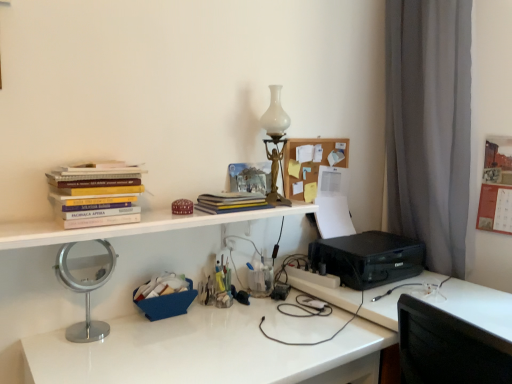
Where is `vacant region to the right of translucent plastic container at center, the second stationery when ordered from bottom to top`? The width and height of the screenshot is (512, 384). vacant region to the right of translucent plastic container at center, the second stationery when ordered from bottom to top is located at coordinates (260, 305).